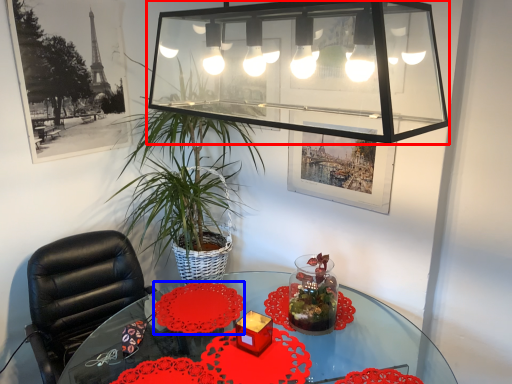
Question: Which of the following is the farthest to the observer, glass box (highlighted by a red box) or flower (highlighted by a blue box)?

Choices:
 (A) glass box
 (B) flower

Answer: (B)